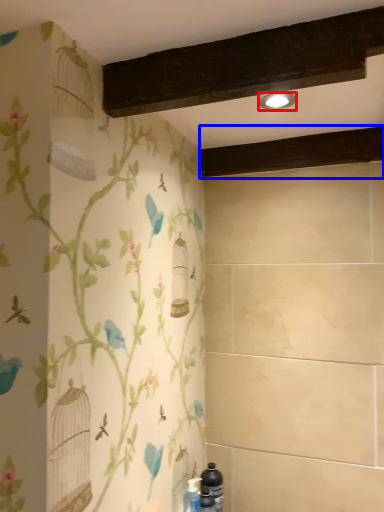
Question: Which object appears closest to the camera in this image, light fixture (highlighted by a red box) or plank (highlighted by a blue box)?

Choices:
 (A) light fixture
 (B) plank

Answer: (A)